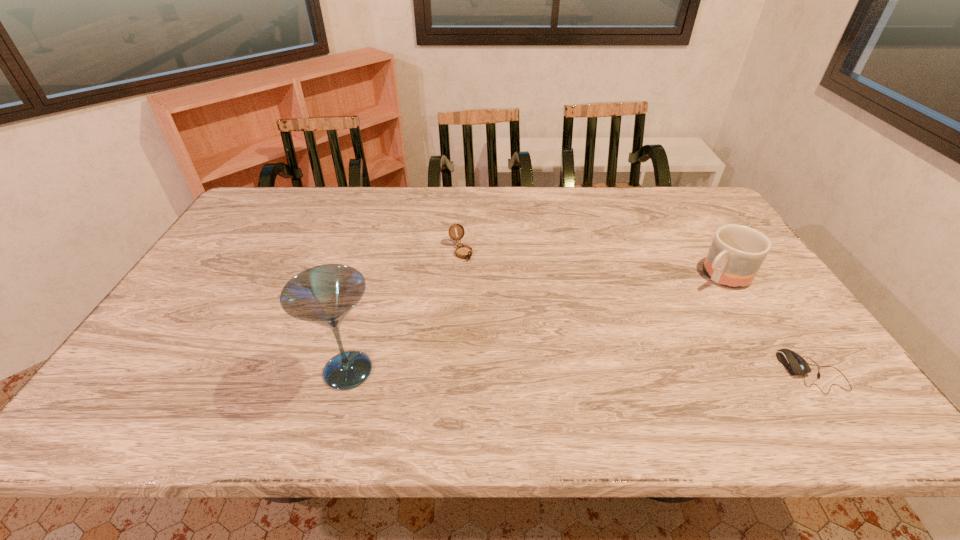
At what (x,y) coordinates should I click in order to perform the action: click on vacant space on the desktop that is between the leftmost object and the shortest object and is positioned on the face of the compass. Please return your answer as a coordinate pair (x, y). This screenshot has height=540, width=960. Looking at the image, I should click on (543, 371).

You are a GUI agent. You are given a task and a screenshot of the screen. Output one action in this format:
    pyautogui.click(x=<x>, y=<y>)
    Task: Click on the free space on the desktop that is between the tallest object and the computer mouse and is positioned on the side with the handle of the mug
    
    Given the screenshot: What is the action you would take?
    pyautogui.click(x=579, y=372)